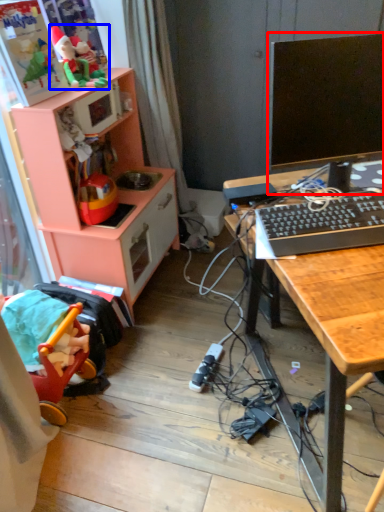
Question: Which object appears farthest to the camera in this image, computer monitor (highlighted by a red box) or toy (highlighted by a blue box)?

Choices:
 (A) computer monitor
 (B) toy

Answer: (B)